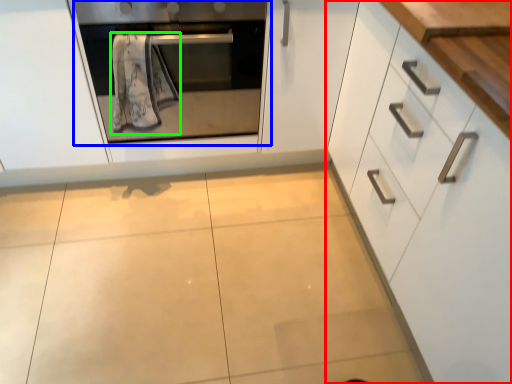
Question: Based on their relative distances, which object is farther from cabinetry (highlighted by a red box)? Choose from oven (highlighted by a blue box) and bath towel (highlighted by a green box).

Choices:
 (A) oven
 (B) bath towel

Answer: (B)